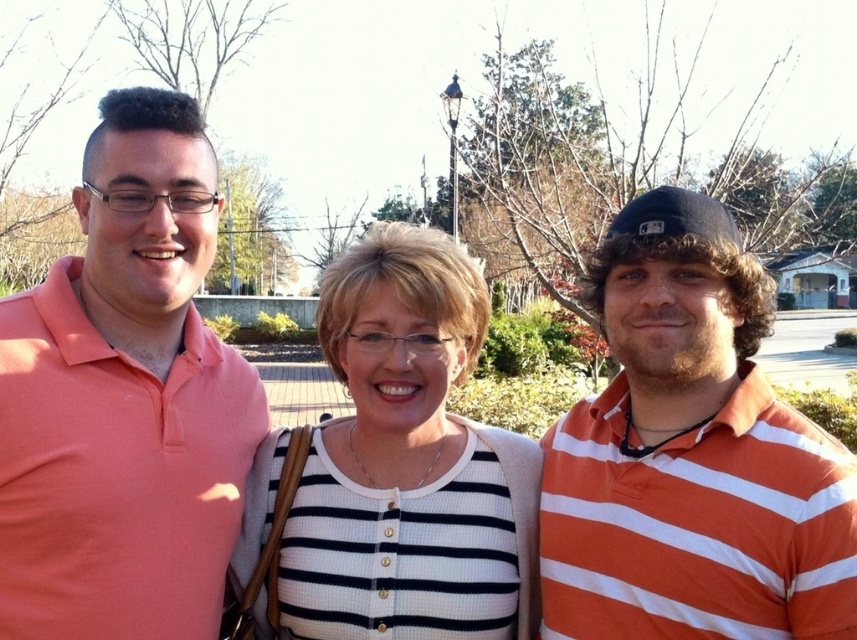
Is matte coral polo shirt at left wider than white striped sweater at center?

No, matte coral polo shirt at left is not wider than white striped sweater at center.

Which is above, matte coral polo shirt at left or white striped sweater at center?

matte coral polo shirt at left

Measure the distance between matte coral polo shirt at left and camera.

A distance of 2.29 meters exists between matte coral polo shirt at left and camera.

Find the location of a particular element. The image size is (857, 640). matte coral polo shirt at left is located at coordinates (124, 400).

Consider the image. Does orange striped polo shirt at right appear on the right side of white striped sweater at center?

Yes, orange striped polo shirt at right is to the right of white striped sweater at center.

Between point (836, 492) and point (255, 611), which one is positioned in front?

Point (836, 492)

Which is behind, point (544, 589) or point (337, 296)?

Point (544, 589)

Locate an element on the screen. The width and height of the screenshot is (857, 640). orange striped polo shirt at right is located at coordinates (691, 456).

Can you confirm if matte coral polo shirt at left is positioned to the left of orange striped polo shirt at right?

Correct, you'll find matte coral polo shirt at left to the left of orange striped polo shirt at right.

Locate an element on the screen. matte coral polo shirt at left is located at coordinates (124, 400).